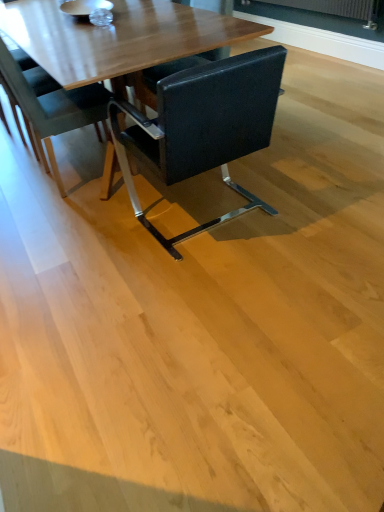
The width and height of the screenshot is (384, 512). I want to click on vacant region to the left of black leather chair at center, the 1th chair viewed from the left, so click(x=19, y=186).